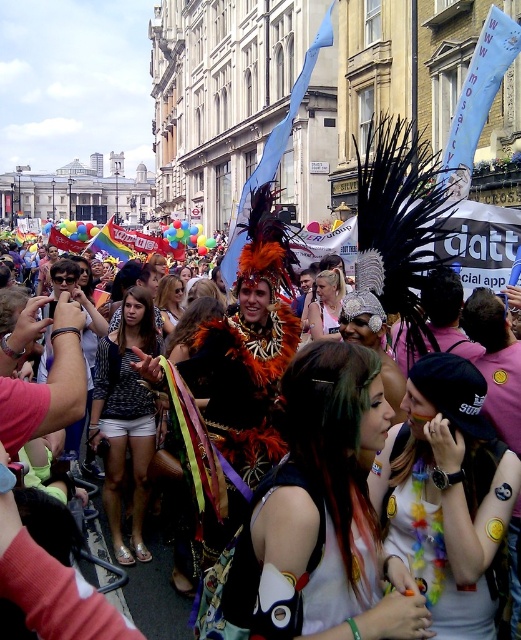
Question: Which point is farther to the camera?

Choices:
 (A) feathered headdress at center
 (B) multicolored sequined top at center

Answer: (A)

Question: Does feathered headdress at center appear on the left side of shiny metallic top at center?

Choices:
 (A) yes
 (B) no

Answer: (B)

Question: Which point is farther to the camera?

Choices:
 (A) (145, 404)
 (B) (388, 545)

Answer: (A)

Question: Does feathered headdress at center appear under multicolored sequined top at center?

Choices:
 (A) no
 (B) yes

Answer: (A)

Question: Observing the image, what is the correct spatial positioning of feathered headdress at center in reference to shiny metallic top at center?

Choices:
 (A) above
 (B) below

Answer: (A)

Question: Which of the following is the farthest from the observer?

Choices:
 (A) feathered headdress at center
 (B) multicolored sequined top at center

Answer: (A)